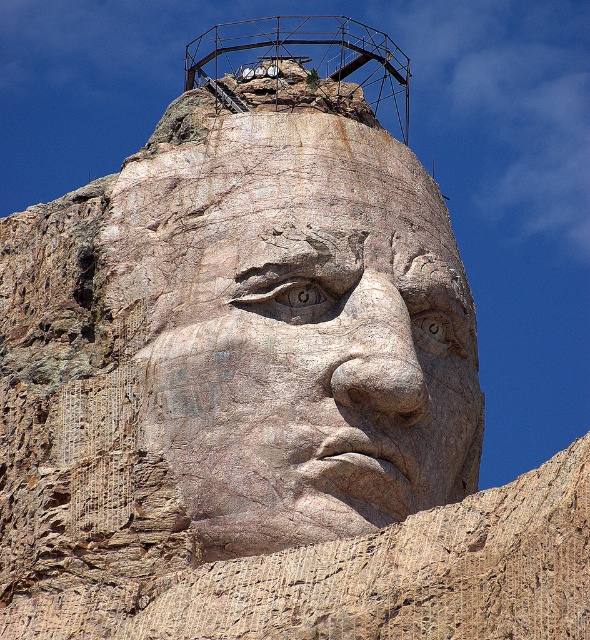
Looking at this image, does carved stone face at center have a larger size compared to rusty metal water tower at upper center?

No.

You are a GUI agent. You are given a task and a screenshot of the screen. Output one action in this format:
    pyautogui.click(x=<x>, y=<y>)
    Task: Click on the carved stone face at center
    The height and width of the screenshot is (640, 590).
    Given the screenshot: What is the action you would take?
    pyautogui.click(x=299, y=330)